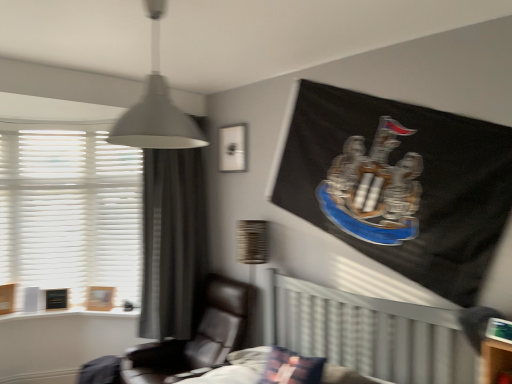
Question: Is matte white picture frame at upper center, the 1th picture frame positioned from the top, to the right of wooden textured lampshade at center from the viewer's perspective?

Choices:
 (A) no
 (B) yes

Answer: (A)

Question: Is matte white picture frame at upper center, which is the first picture frame in right-to-left order, not within wooden textured lampshade at center?

Choices:
 (A) no
 (B) yes

Answer: (B)

Question: Can you confirm if matte white picture frame at upper center, positioned as the second picture frame in back-to-front order, is shorter than wooden textured lampshade at center?

Choices:
 (A) yes
 (B) no

Answer: (A)

Question: Is matte white picture frame at upper center, the 1th picture frame positioned from the top, positioned in front of wooden textured lampshade at center?

Choices:
 (A) no
 (B) yes

Answer: (A)

Question: Is matte white picture frame at upper center, the 1th picture frame positioned from the top, turned away from wooden textured lampshade at center?

Choices:
 (A) yes
 (B) no

Answer: (B)

Question: Does matte white picture frame at upper center, the 1th picture frame positioned from the top, turn towards wooden textured lampshade at center?

Choices:
 (A) yes
 (B) no

Answer: (B)

Question: Can you confirm if white matte lampshade at upper center is positioned to the left of wooden textured lampshade at center?

Choices:
 (A) no
 (B) yes

Answer: (B)

Question: Is white matte lampshade at upper center next to wooden textured lampshade at center?

Choices:
 (A) no
 (B) yes

Answer: (A)

Question: Is wooden textured lampshade at center at the back of white matte lampshade at upper center?

Choices:
 (A) yes
 (B) no

Answer: (B)

Question: Does white matte lampshade at upper center have a lesser height compared to wooden textured lampshade at center?

Choices:
 (A) no
 (B) yes

Answer: (B)

Question: Is white matte lampshade at upper center not near wooden textured lampshade at center?

Choices:
 (A) yes
 (B) no

Answer: (A)

Question: Does white matte lampshade at upper center have a smaller size compared to wooden textured lampshade at center?

Choices:
 (A) yes
 (B) no

Answer: (B)

Question: From the image's perspective, is black leather chair at center over white textured blinds at left?

Choices:
 (A) no
 (B) yes

Answer: (A)